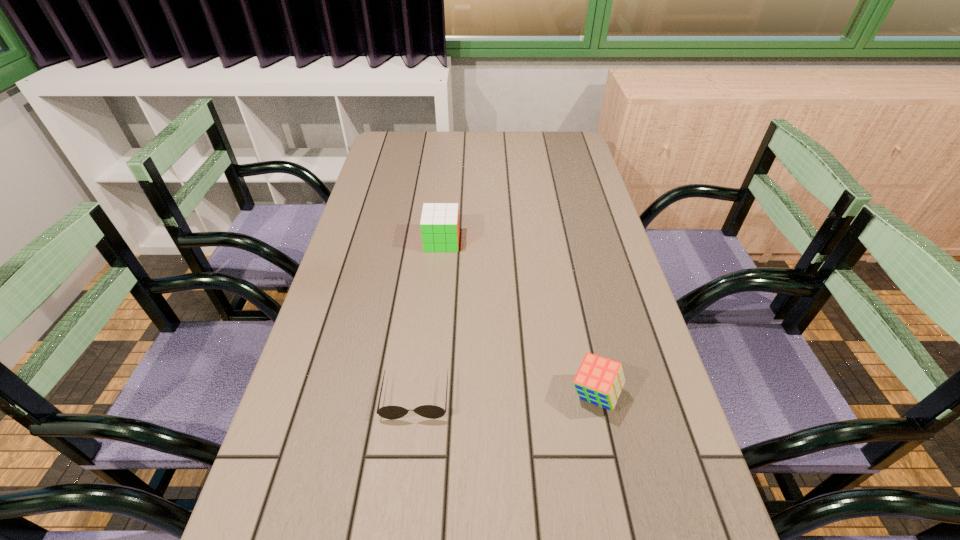
Where is `vacant space at the left edge of the desktop`? The height and width of the screenshot is (540, 960). vacant space at the left edge of the desktop is located at coordinates 342,336.

This screenshot has height=540, width=960. I want to click on vacant area at the right edge, so click(556, 193).

Where is `vacant region at the far right corner of the desktop`? vacant region at the far right corner of the desktop is located at coordinates (582, 152).

You are a GUI agent. You are given a task and a screenshot of the screen. Output one action in this format:
    pyautogui.click(x=<x>, y=<y>)
    Task: Click on the vacant area that lies between the sunglasses and the nearer cube
    This screenshot has height=540, width=960.
    Given the screenshot: What is the action you would take?
    pyautogui.click(x=505, y=396)

Locate an element on the screen. free space between the shortest object and the left cube is located at coordinates (428, 319).

This screenshot has height=540, width=960. I want to click on free space between the farther cube and the shortest object, so click(428, 319).

This screenshot has width=960, height=540. Identify the location of empty space that is in between the sunglasses and the left cube. (428, 319).

The width and height of the screenshot is (960, 540). Find the location of `free spot between the shortest object and the rightmost object`. free spot between the shortest object and the rightmost object is located at coordinates (505, 396).

Identify the location of vacant area that lies between the sunglasses and the nearer cube. This screenshot has width=960, height=540. (505, 396).

Locate an element on the screen. The height and width of the screenshot is (540, 960). empty space that is in between the left cube and the rightmost object is located at coordinates (518, 318).